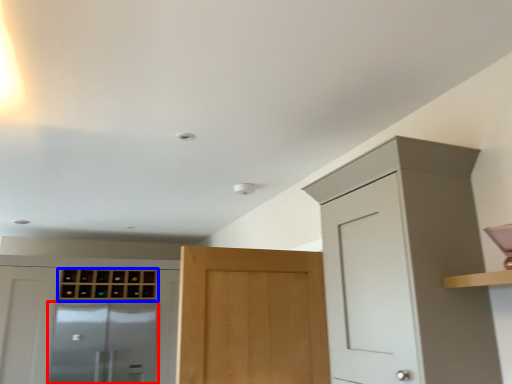
Question: Which object is closer to the camera taking this photo, screen door (highlighted by a red box) or cabinetry (highlighted by a blue box)?

Choices:
 (A) screen door
 (B) cabinetry

Answer: (A)